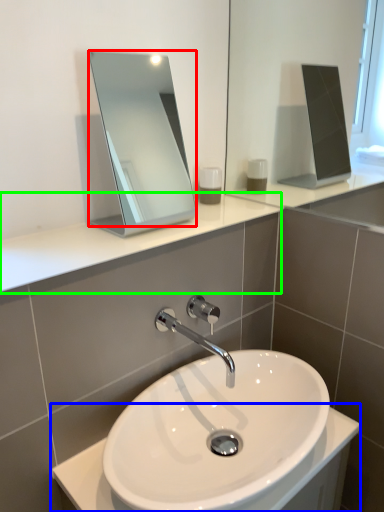
Question: Based on their relative distances, which object is nearer to mirror (highlighted by a red box)? Choose from counter top (highlighted by a blue box) and counter top (highlighted by a green box).

Choices:
 (A) counter top
 (B) counter top

Answer: (B)